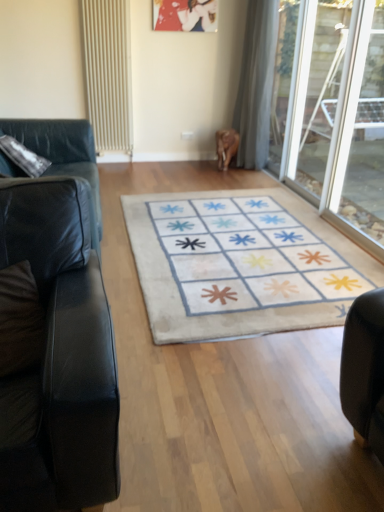
Question: In the image, is black leather couch at left, which appears as the 1th studio couch when viewed from the back, positioned in front of or behind black leather couch at left, positioned as the first studio couch in front-to-back order?

Choices:
 (A) behind
 (B) front

Answer: (A)

Question: Does point (61, 140) appear closer or farther from the camera than point (3, 466)?

Choices:
 (A) farther
 (B) closer

Answer: (A)

Question: Based on their relative distances, which object is farther from the black leather couch at left, positioned as the first studio couch in front-to-back order?

Choices:
 (A) transparent glass door at right, which is the 1th glass door in front-to-back order
 (B) transparent glass door at right, the 1th glass door from the back
 (C) metallic silver picture frame at upper center
 (D) white sheer curtain at upper center
 (E) beige textured radiator at upper left

Answer: (C)

Question: Estimate the real-world distances between objects in this image. Which object is closer to the white sheer curtain at upper center?

Choices:
 (A) black leather couch at left, placed as the second studio couch when sorted from front to back
 (B) beige textured radiator at upper left
 (C) brown suede pillow at left
 (D) white soft rug at center
 (E) black leather couch at left, positioned as the first studio couch in front-to-back order

Answer: (B)